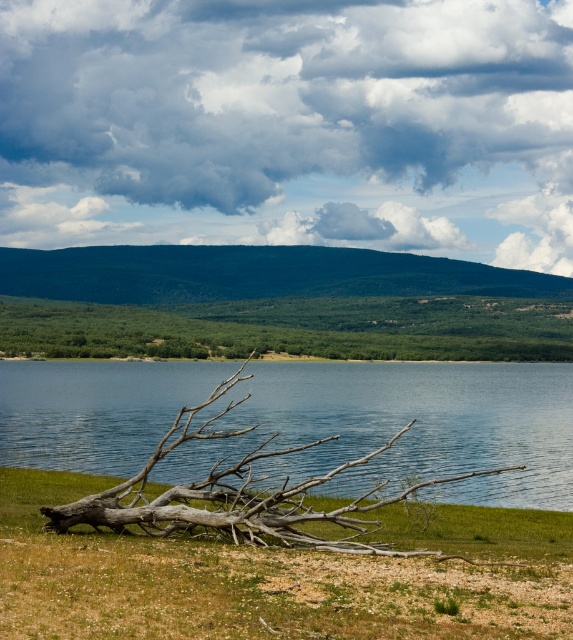
You are standing in the serene landscape and want to take a photo of the cloudy sky at upper center and the green leafy tree at center. Which object is located to the right of the other?

The cloudy sky at upper center is positioned on the right side of green leafy tree at center.

Based on the scene description, which object occupies a larger portion of the image, the cloudy sky at upper center or the clear blue water at center?

The cloudy sky at upper center is bigger than the clear blue water at center, so the cloudy sky at upper center occupies a larger portion of the image.

You are standing at the edge of the water in the serene landscape and notice two points marked on the ground. The first point is at coordinates point (446, 51), and the second is at point (32, 426). Which point is closer to your current position?

Point (446, 51) is further to the viewer than point (32, 426), so the closer point to your current position is point (32, 426).